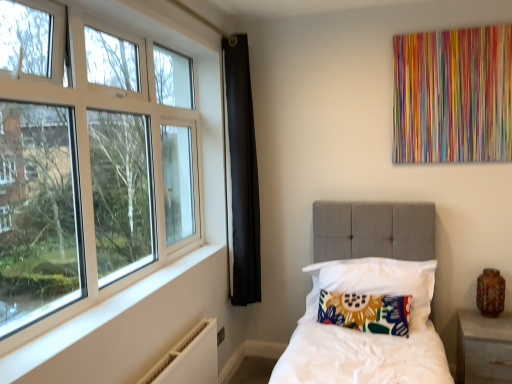
Question: Is white textured radiator at lower left touching matte gray nightstand at lower right?

Choices:
 (A) no
 (B) yes

Answer: (A)

Question: Is white textured radiator at lower left located outside matte gray nightstand at lower right?

Choices:
 (A) no
 (B) yes

Answer: (B)

Question: Can you confirm if white textured radiator at lower left is thinner than matte gray nightstand at lower right?

Choices:
 (A) no
 (B) yes

Answer: (B)

Question: Is white textured radiator at lower left behind matte gray nightstand at lower right?

Choices:
 (A) yes
 (B) no

Answer: (B)

Question: Is white textured radiator at lower left smaller than matte gray nightstand at lower right?

Choices:
 (A) yes
 (B) no

Answer: (A)

Question: From the image's perspective, is white plastic window at left positioned above or below floral fabric pillow at center, marked as the 2th pillow in a bottom-to-top arrangement?

Choices:
 (A) below
 (B) above

Answer: (B)

Question: Considering the positions of white plastic window at left and floral fabric pillow at center, marked as the 2th pillow in a bottom-to-top arrangement, in the image, is white plastic window at left wider or thinner than floral fabric pillow at center, marked as the 2th pillow in a bottom-to-top arrangement,?

Choices:
 (A) thin
 (B) wide

Answer: (B)

Question: Based on their positions, is white plastic window at left located to the left or right of floral fabric pillow at center, marked as the 2th pillow in a bottom-to-top arrangement?

Choices:
 (A) left
 (B) right

Answer: (A)

Question: From a real-world perspective, is white plastic window at left above or below floral fabric pillow at center, marked as the 2th pillow in a bottom-to-top arrangement?

Choices:
 (A) above
 (B) below

Answer: (A)

Question: From the image's perspective, is floral fabric pillow at center, the second pillow viewed from the top, located above or below white plastic window at left?

Choices:
 (A) above
 (B) below

Answer: (B)

Question: Is floral fabric pillow at center, the second pillow viewed from the top, taller or shorter than white plastic window at left?

Choices:
 (A) tall
 (B) short

Answer: (B)

Question: Is floral fabric pillow at center, the second pillow viewed from the top, bigger or smaller than white plastic window at left?

Choices:
 (A) small
 (B) big

Answer: (A)

Question: In the image, is floral fabric pillow at center, which appears as the 1th pillow when ordered from the bottom, on the left side or the right side of white plastic window at left?

Choices:
 (A) left
 (B) right

Answer: (B)

Question: Visually, is floral fabric pillow at center, marked as the 2th pillow in a bottom-to-top arrangement, positioned to the left or to the right of white plastic window at left?

Choices:
 (A) left
 (B) right

Answer: (B)

Question: Is floral fabric pillow at center, the 1th pillow viewed from the top, in front of or behind white plastic window at left in the image?

Choices:
 (A) behind
 (B) front

Answer: (A)